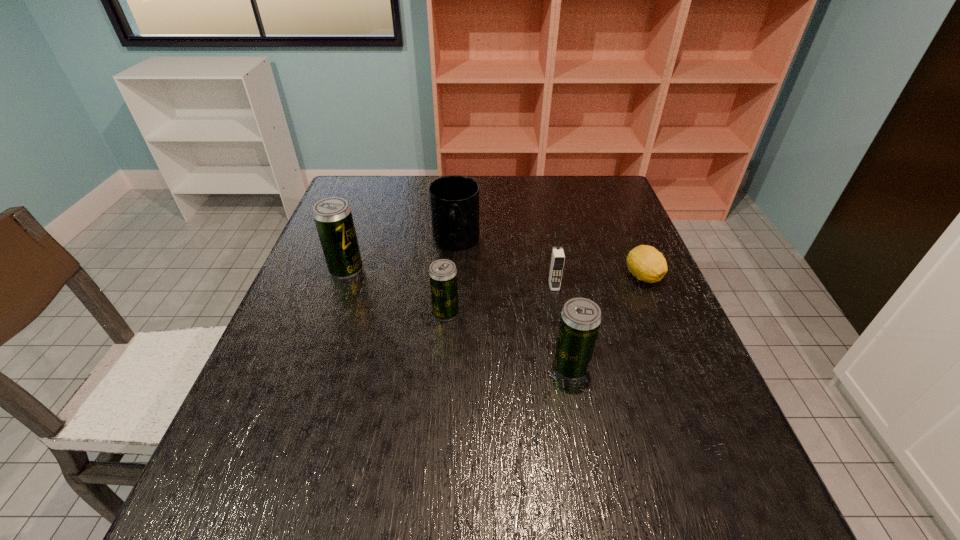
Find the location of a particular element. vacant space at the left edge of the desktop is located at coordinates (331, 348).

In the image, there is a desktop. Where is `free space at the right edge`? This screenshot has width=960, height=540. free space at the right edge is located at coordinates (639, 388).

Find the location of a particular element. The width and height of the screenshot is (960, 540). vacant region at the near left corner is located at coordinates (229, 426).

This screenshot has height=540, width=960. Find the location of `free region at the far right corner`. free region at the far right corner is located at coordinates (580, 198).

Where is `free spot at the near right corner of the desktop`? The height and width of the screenshot is (540, 960). free spot at the near right corner of the desktop is located at coordinates (725, 461).

Locate an element on the screen. The image size is (960, 540). vacant region between the second tallest beer can and the leftmost beer can is located at coordinates (459, 319).

This screenshot has width=960, height=540. I want to click on vacant area that lies between the nearest beer can and the mug, so click(x=514, y=305).

Find the location of a particular element. free space between the cellular telephone and the second nearest object is located at coordinates (500, 299).

Where is `vacant region between the rightmost beer can and the mug`? This screenshot has height=540, width=960. vacant region between the rightmost beer can and the mug is located at coordinates (514, 305).

I want to click on vacant space in between the shortest beer can and the shortest object, so click(x=544, y=294).